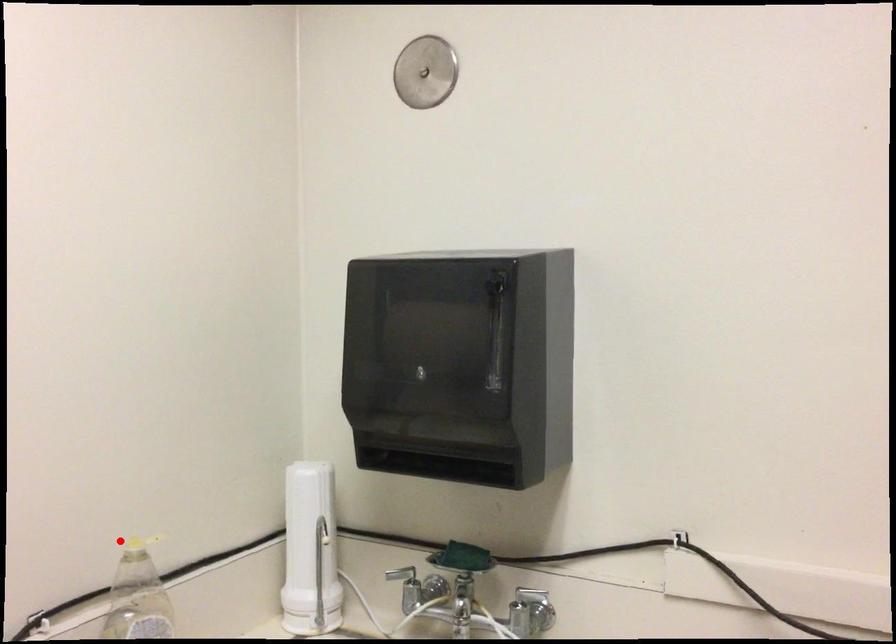
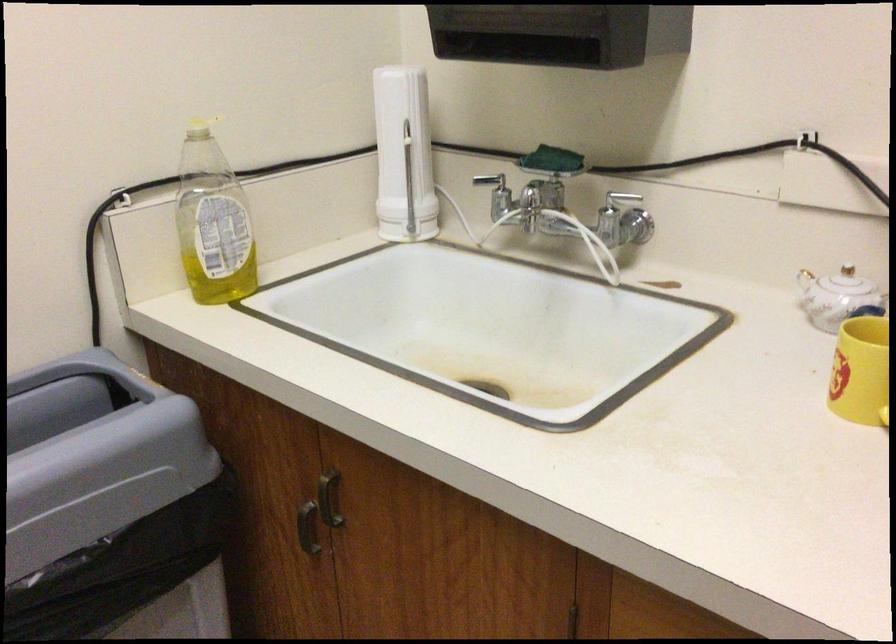
Find the pixel in the second image that matches the highlighted location in the first image.

(200, 128)